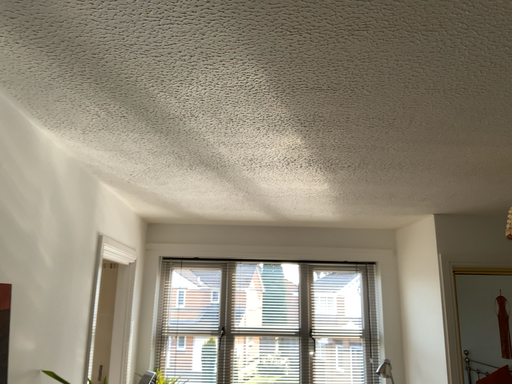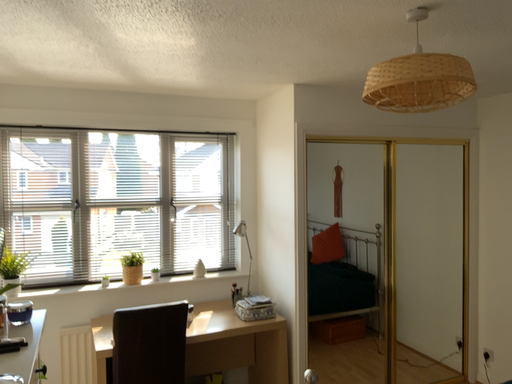
Question: Which way did the camera rotate in the video?

Choices:
 (A) rotated downward
 (B) rotated upward

Answer: (A)